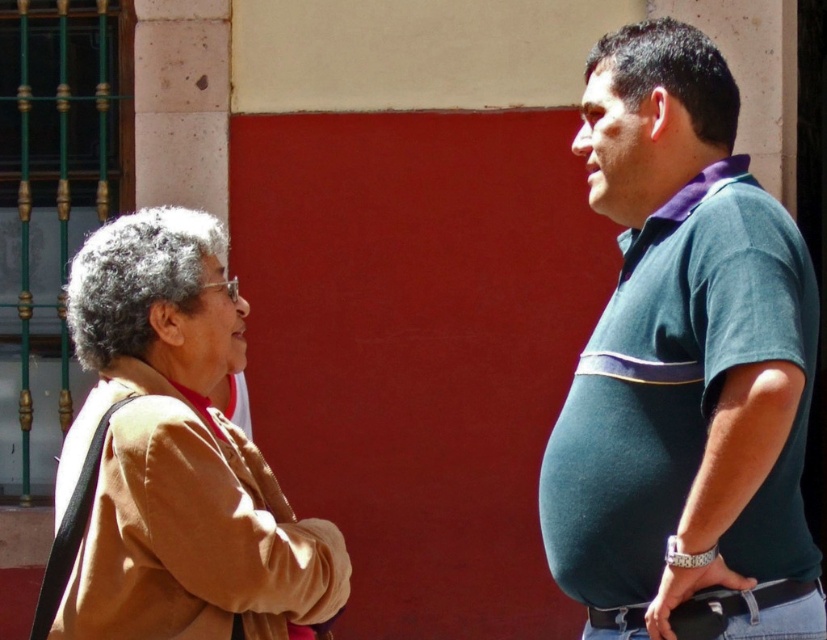
You are standing in front of the two people in the image. The green cotton shirt at right is located at point [684,364]. Where is the green cotton shirt at right relative to the older woman on the left?

The green cotton shirt at right is located at point [684,364], which is to the right of the older woman on the left.

You are a fashion designer observing two people in an outdoor setting. The scene includes a green cotton shirt at right and a light brown fabric jacket at left. Which clothing item appears taller in the image?

The green cotton shirt at right appears much taller than the light brown fabric jacket at left in the image.

You are standing in front of the building and want to place a decoration at the point closer to the camera between point (679, 381) and point (67, 316). Which point should you choose?

You should choose point (679, 381) because it is closer to the camera than point (67, 316).